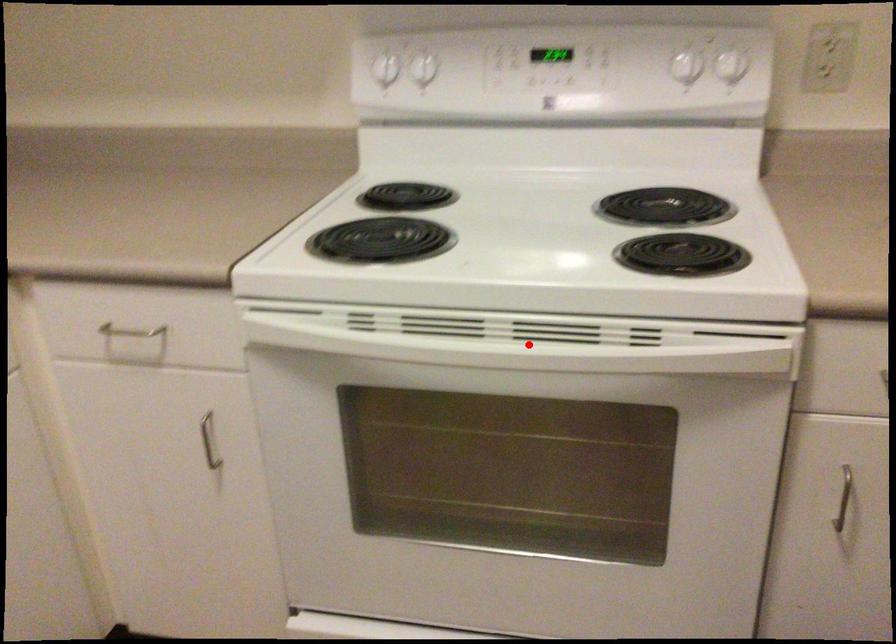
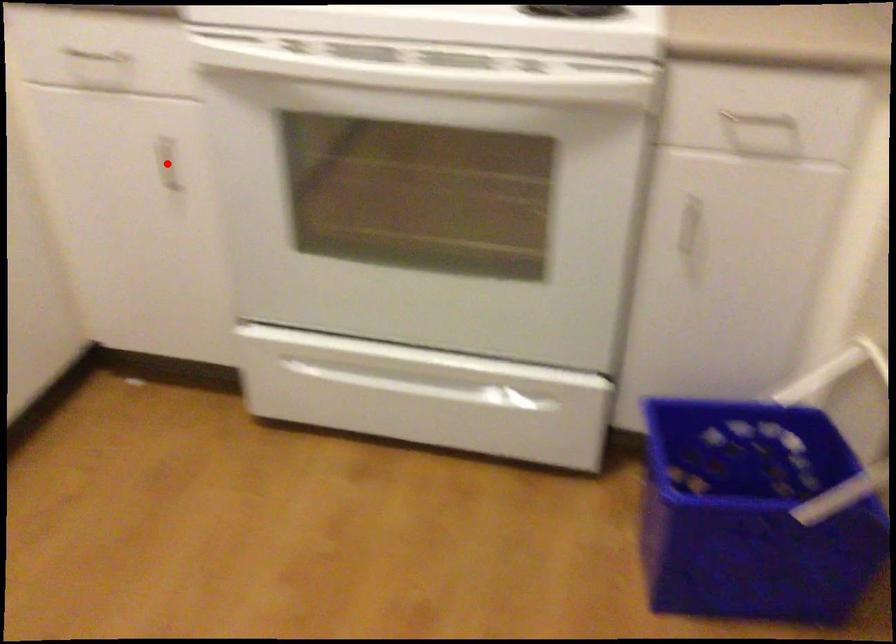
I am providing you with two images of the same scene from different viewpoints. A red point is marked on the first image and another point is marked on the second image. Does the point marked in image1 correspond to the same location as the one in image2?

No